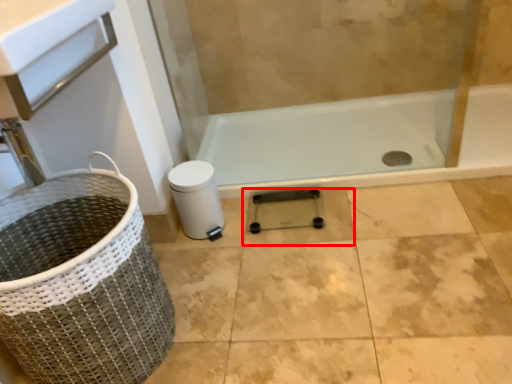
Question: In this image, where is tile (annotated by the red box) located relative to basket container?

Choices:
 (A) left
 (B) right

Answer: (B)